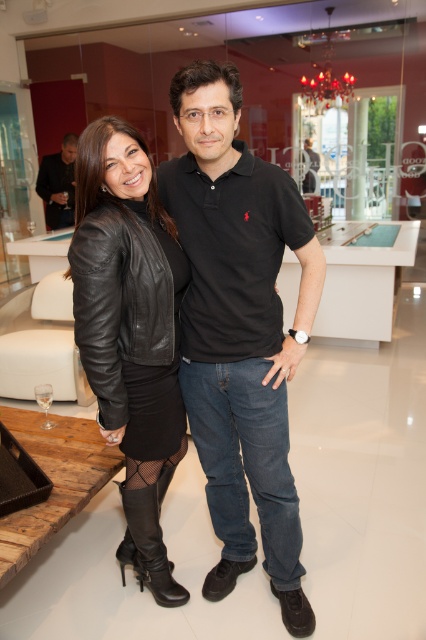
Is black leather polo shirt at center wider than black leather jacket at left?

Yes, black leather polo shirt at center is wider than black leather jacket at left.

Can you confirm if black leather polo shirt at center is bigger than black leather jacket at left?

Correct, black leather polo shirt at center is larger in size than black leather jacket at left.

At what (x,y) coordinates should I click in order to perform the action: click on black leather polo shirt at center. Please return your answer as a coordinate pair (x, y). The height and width of the screenshot is (640, 426). Looking at the image, I should click on (239, 330).

Which is below, black leather polo shirt at center or black leather jacket at center?

black leather jacket at center

Which is more to the left, black leather polo shirt at center or black leather jacket at center?

Positioned to the left is black leather jacket at center.

You are a GUI agent. You are given a task and a screenshot of the screen. Output one action in this format:
    pyautogui.click(x=<x>, y=<y>)
    Task: Click on the black leather polo shirt at center
    
    Given the screenshot: What is the action you would take?
    pyautogui.click(x=239, y=330)

Does black leather jacket at center appear over black leather jacket at left?

No.

Can you confirm if black leather jacket at center is positioned below black leather jacket at left?

Yes.

Is point (118, 349) farther from viewer compared to point (46, 170)?

No.

You are a GUI agent. You are given a task and a screenshot of the screen. Output one action in this format:
    pyautogui.click(x=<x>, y=<y>)
    Task: Click on the black leather jacket at center
    This screenshot has width=426, height=640.
    Given the screenshot: What is the action you would take?
    pyautogui.click(x=131, y=332)